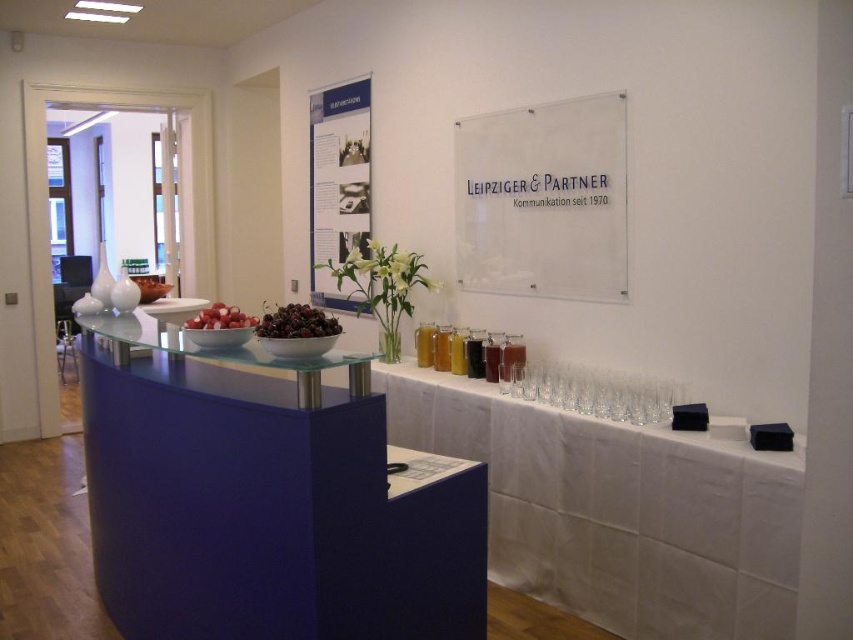
Question: Which point is farther from the camera taking this photo?

Choices:
 (A) (274, 314)
 (B) (625, 108)
 (C) (525, 563)
 (D) (123, 460)

Answer: (C)

Question: Which object appears farthest from the camera in this image?

Choices:
 (A) white fabric at lower right
 (B) transparent acrylic sign at upper center

Answer: (B)

Question: Can you confirm if matte blue table at center is thinner than transparent acrylic sign at upper center?

Choices:
 (A) yes
 (B) no

Answer: (B)

Question: Does white fabric at lower right have a smaller size compared to red matte radish at center?

Choices:
 (A) no
 (B) yes

Answer: (A)

Question: Considering the real-world distances, which object is closest to the shiny dark red cherries at center?

Choices:
 (A) white fabric at lower right
 (B) matte blue table at center

Answer: (B)

Question: Is the position of white fabric at lower right more distant than that of shiny dark red cherries at center?

Choices:
 (A) no
 (B) yes

Answer: (B)